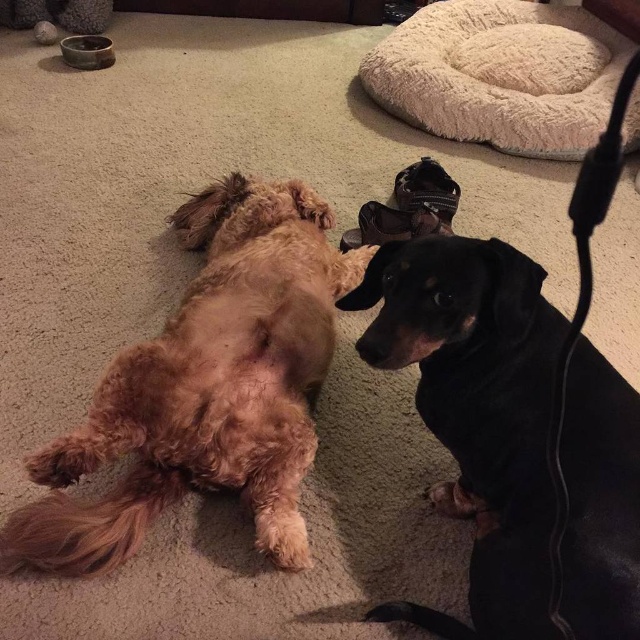
Does beige fluffy dog bed at upper center have a lesser height compared to leather/black shoe at center?

Incorrect, beige fluffy dog bed at upper center's height does not fall short of leather/black shoe at center's.

Is point (570, 12) positioned in front of point (436, 218)?

No, it is not.

Where is `beige fluffy dog bed at upper center`? The image size is (640, 640). beige fluffy dog bed at upper center is located at coordinates (500, 74).

Is black smooth dog at center below leather/black shoe at center?

Correct, black smooth dog at center is located below leather/black shoe at center.

Locate an element on the screen. black smooth dog at center is located at coordinates (476, 410).

Between point (502, 408) and point (404, 221), which one is positioned behind?

Positioned behind is point (404, 221).

What are the coordinates of `black smooth dog at center` in the screenshot? It's located at (476, 410).

Based on the photo, between fuzzy brown dog at upper left and black smooth dog at center, which one has more height?

With more height is fuzzy brown dog at upper left.

Is fuzzy brown dog at upper left closer to the viewer compared to black smooth dog at center?

No, it is not.

What do you see at coordinates (205, 388) in the screenshot?
I see `fuzzy brown dog at upper left` at bounding box center [205, 388].

This screenshot has height=640, width=640. I want to click on fuzzy brown dog at upper left, so click(205, 388).